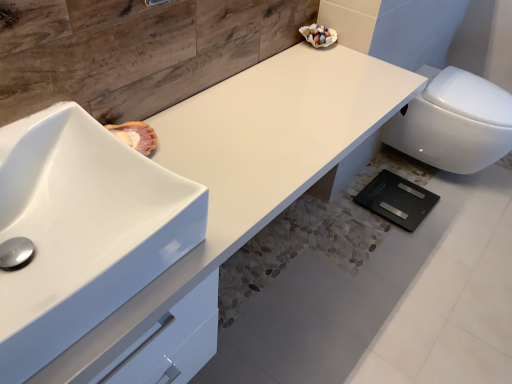
Identify the location of empty space that is ontop of white glossy counter top at center (from a real-world perspective). (269, 119).